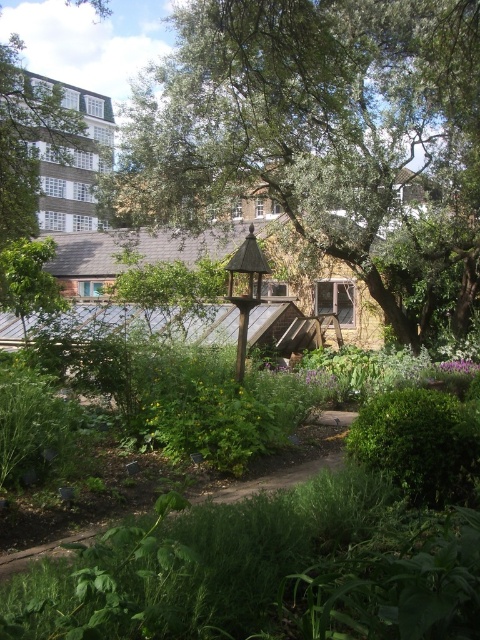
Does brown dirt path at center have a lesser height compared to wooden gazebo at center?

Result: Indeed, brown dirt path at center has a lesser height compared to wooden gazebo at center.

Is brown dirt path at center below wooden gazebo at center?

Yes, brown dirt path at center is below wooden gazebo at center.

Identify the location of brown dirt path at center. (288, 465).

Can you confirm if green leafy tree at center is bigger than wooden gazebo at center?

Indeed, green leafy tree at center has a larger size compared to wooden gazebo at center.

Who is more forward, (x=394, y=129) or (x=236, y=252)?

Positioned in front is point (x=236, y=252).

At what (x,y) coordinates should I click in order to perform the action: click on green leafy tree at center. Please return your answer as a coordinate pair (x, y). This screenshot has width=480, height=640. Looking at the image, I should click on (324, 138).

Can you confirm if green leafy tree at center is positioned below brown dirt path at center?

Actually, green leafy tree at center is above brown dirt path at center.

Describe the element at coordinates (324, 138) in the screenshot. I see `green leafy tree at center` at that location.

Who is more distant from viewer, (178, 125) or (342, 452)?

The point (178, 125) is behind.

Identify the location of green leafy tree at center. (324, 138).